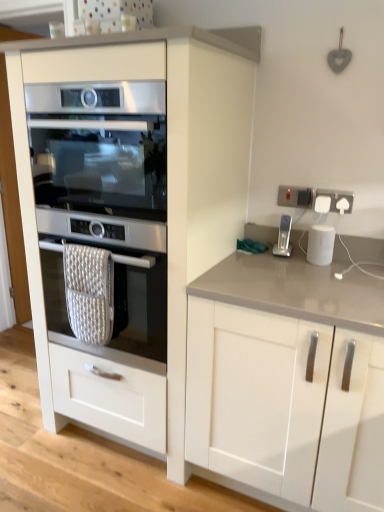
Question: Should I look upward or downward to see satin silver oven at center, marked as the 2th oven in a top-to-bottom arrangement?

Choices:
 (A) down
 (B) up

Answer: (A)

Question: Is silver metallic stapler at right outside of white plastic socket at upper right, which is the 2th electric outlet from left to right?

Choices:
 (A) yes
 (B) no

Answer: (A)

Question: Is silver metallic stapler at right far away from white plastic socket at upper right, which is the 2th electric outlet from left to right?

Choices:
 (A) no
 (B) yes

Answer: (A)

Question: Is silver metallic stapler at right taller than white plastic socket at upper right, marked as the first electric outlet in a right-to-left arrangement?

Choices:
 (A) yes
 (B) no

Answer: (A)

Question: From the image's perspective, would you say silver metallic stapler at right is shown under white plastic socket at upper right, which is the 2th electric outlet from left to right?

Choices:
 (A) no
 (B) yes

Answer: (B)

Question: From a real-world perspective, is silver metallic stapler at right beneath white plastic socket at upper right, which is the 2th electric outlet from left to right?

Choices:
 (A) no
 (B) yes

Answer: (B)

Question: Is silver metallic stapler at right bigger than white plastic socket at upper right, which is the 2th electric outlet from left to right?

Choices:
 (A) yes
 (B) no

Answer: (A)

Question: Does white glossy smart speaker at right have a lesser height compared to white glossy cabinet at left, positioned as the 2th cabinetry in right-to-left order?

Choices:
 (A) no
 (B) yes

Answer: (B)

Question: Is white glossy smart speaker at right thinner than white glossy cabinet at left, which ranks as the first cabinetry in left-to-right order?

Choices:
 (A) no
 (B) yes

Answer: (B)

Question: Is white glossy smart speaker at right to the left of white glossy cabinet at left, which ranks as the first cabinetry in left-to-right order, from the viewer's perspective?

Choices:
 (A) no
 (B) yes

Answer: (A)

Question: Is the position of white glossy smart speaker at right more distant than that of white glossy cabinet at left, which ranks as the first cabinetry in left-to-right order?

Choices:
 (A) no
 (B) yes

Answer: (B)

Question: Can you confirm if white glossy smart speaker at right is bigger than white glossy cabinet at left, positioned as the 2th cabinetry in right-to-left order?

Choices:
 (A) no
 (B) yes

Answer: (A)

Question: Are white glossy smart speaker at right and white glossy cabinet at left, positioned as the 2th cabinetry in right-to-left order, far apart?

Choices:
 (A) no
 (B) yes

Answer: (A)

Question: Considering the relative sizes of white plastic socket at upper right, which is the 2th electric outlet from left to right, and satin silver oven at center, the first oven viewed from the top, in the image provided, is white plastic socket at upper right, which is the 2th electric outlet from left to right, shorter than satin silver oven at center, the first oven viewed from the top,?

Choices:
 (A) yes
 (B) no

Answer: (A)